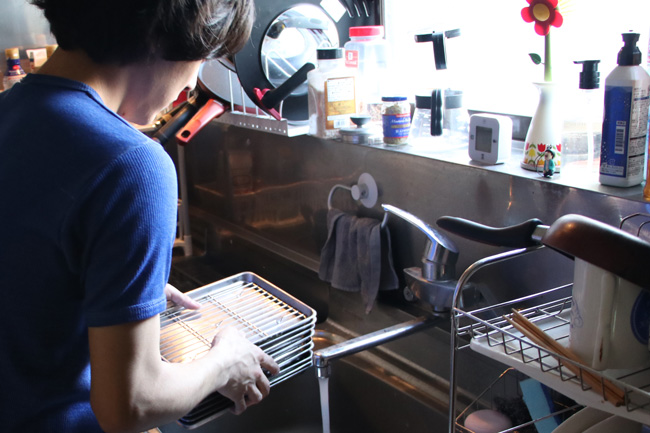
Identify the location of faucet. This screenshot has height=433, width=650. (365, 337), (433, 292), (439, 240).